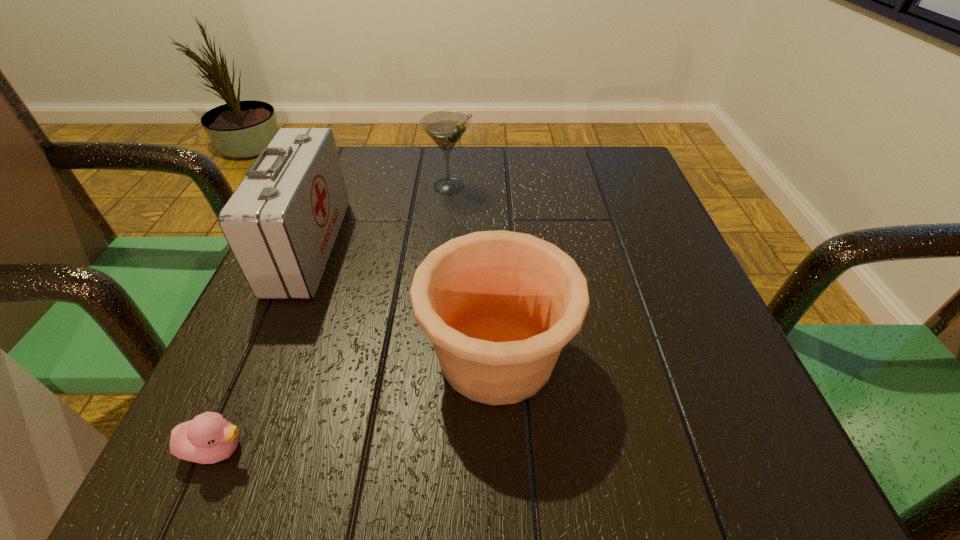
Find the location of a particular element. martini at the far edge is located at coordinates (445, 128).

Image resolution: width=960 pixels, height=540 pixels. In order to click on pottery located in the near edge section of the desktop in this screenshot , I will do `click(499, 306)`.

Image resolution: width=960 pixels, height=540 pixels. Find the location of `duckling that is at the near edge`. duckling that is at the near edge is located at coordinates (208, 438).

Where is `the first-aid kit that is at the left edge`? The image size is (960, 540). the first-aid kit that is at the left edge is located at coordinates (281, 223).

The image size is (960, 540). I want to click on duckling present at the left edge, so click(x=208, y=438).

This screenshot has width=960, height=540. Find the location of `object that is at the far left corner`. object that is at the far left corner is located at coordinates (281, 223).

I want to click on object located at the near left corner, so click(x=208, y=438).

In the image, there is a desktop. What are the coordinates of `blank space at the far edge` in the screenshot? It's located at (426, 191).

You are a GUI agent. You are given a task and a screenshot of the screen. Output one action in this format:
    pyautogui.click(x=<x>, y=<y>)
    Task: Click on the free space at the near edge of the desktop
    Image resolution: width=960 pixels, height=540 pixels.
    Given the screenshot: What is the action you would take?
    (x=495, y=454)

This screenshot has height=540, width=960. I want to click on free region at the right edge of the desktop, so click(x=626, y=294).